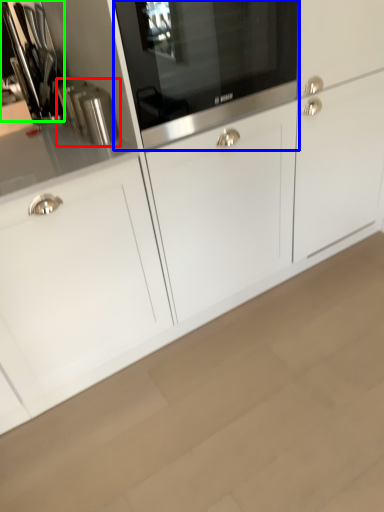
Question: Which is nearer to the kitchen appliance (highlighted by a red box)? home appliance (highlighted by a blue box) or appliance (highlighted by a green box).

Choices:
 (A) home appliance
 (B) appliance

Answer: (B)